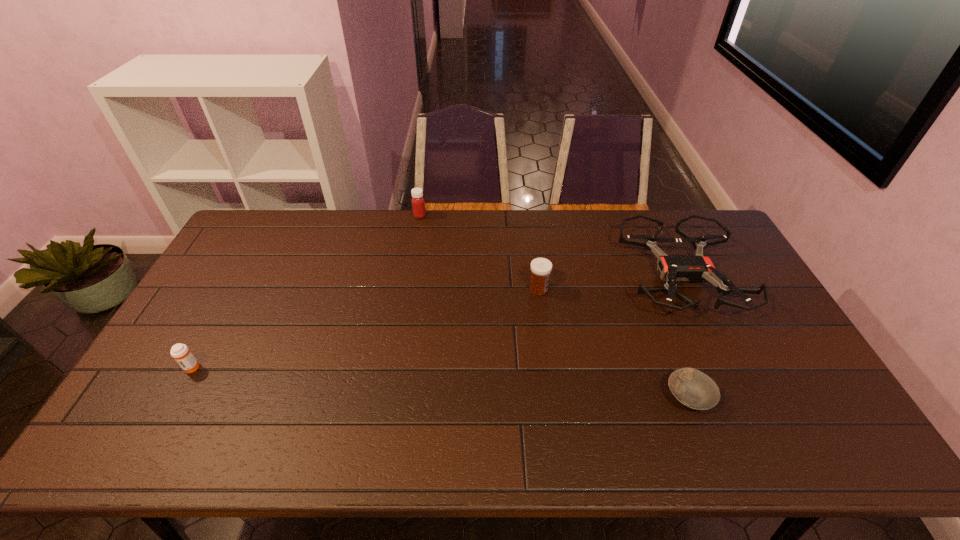
The height and width of the screenshot is (540, 960). Find the location of `the farthest object`. the farthest object is located at coordinates (418, 203).

Identify the location of the farthest medicine. (418, 203).

In order to click on the rightmost medicine in this screenshot , I will do `click(541, 268)`.

Locate an element on the screen. This screenshot has width=960, height=540. the second farthest medicine is located at coordinates (541, 268).

This screenshot has height=540, width=960. I want to click on drone, so click(x=695, y=268).

Locate an element on the screen. the fourth farthest object is located at coordinates (180, 352).

The height and width of the screenshot is (540, 960). Identify the location of the nearest medicine. (180, 352).

The height and width of the screenshot is (540, 960). Find the location of `the shortest object`. the shortest object is located at coordinates (695, 390).

Where is `bowl`? This screenshot has height=540, width=960. bowl is located at coordinates (695, 390).

Find the location of a particular element. vacant space situated on the left of the fourth object from right to left is located at coordinates (314, 215).